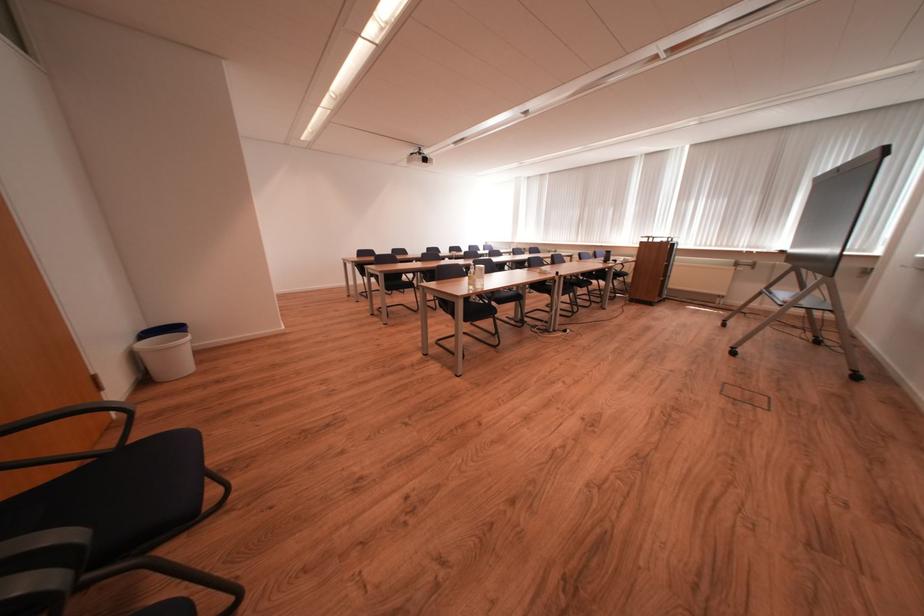
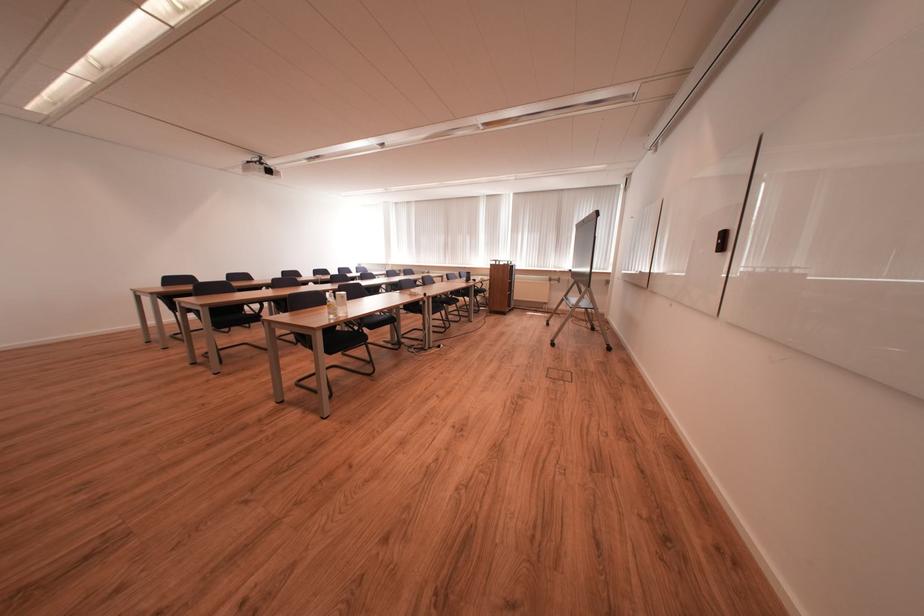
Find the pixel in the second image that matches [403,284] in the first image.

(237, 318)